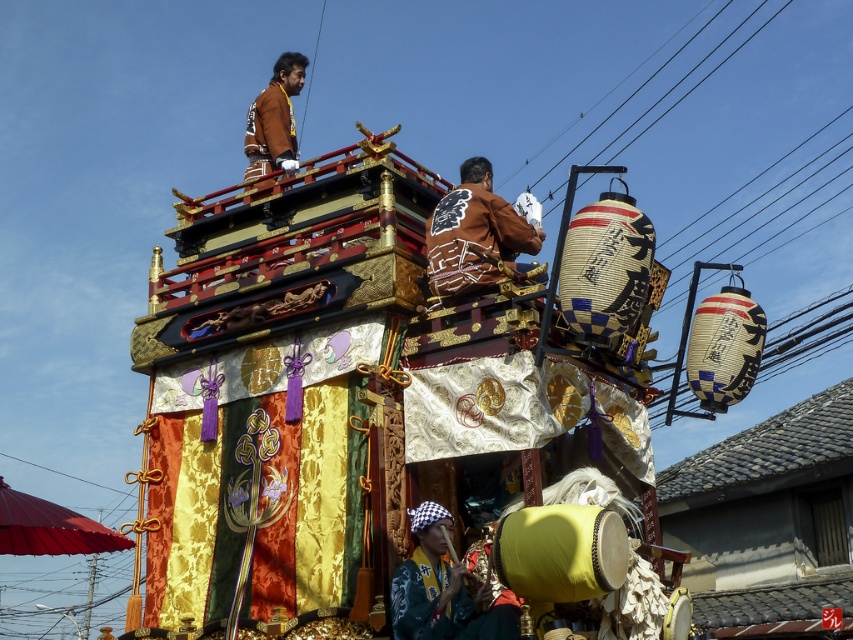
Between brown leather jacket at center and black wire at upper center, which one appears on the left side from the viewer's perspective?

Positioned to the left is brown leather jacket at center.

Is brown leather jacket at center to the left of black wire at upper center from the viewer's perspective?

Indeed, brown leather jacket at center is positioned on the left side of black wire at upper center.

Is point (460, 186) farther from viewer compared to point (572, 152)?

No, (460, 186) is closer to viewer.

Find the location of a particular element. The image size is (853, 640). brown leather jacket at center is located at coordinates (474, 234).

Is brown leather jacket at center to the left of brown leather jacket at upper center from the viewer's perspective?

No, brown leather jacket at center is not to the left of brown leather jacket at upper center.

Does brown leather jacket at center come in front of brown leather jacket at upper center?

Yes, it is.

This screenshot has height=640, width=853. Describe the element at coordinates (474, 234) in the screenshot. I see `brown leather jacket at center` at that location.

At what (x,y) coordinates should I click in order to perform the action: click on brown leather jacket at center. Please return your answer as a coordinate pair (x, y). This screenshot has width=853, height=640. Looking at the image, I should click on (474, 234).

Is point (459, 564) farther from camera compared to point (718, 13)?

No, it is in front of (718, 13).

What are the coordinates of `silk fabric headscarf at lower center` in the screenshot? It's located at (442, 589).